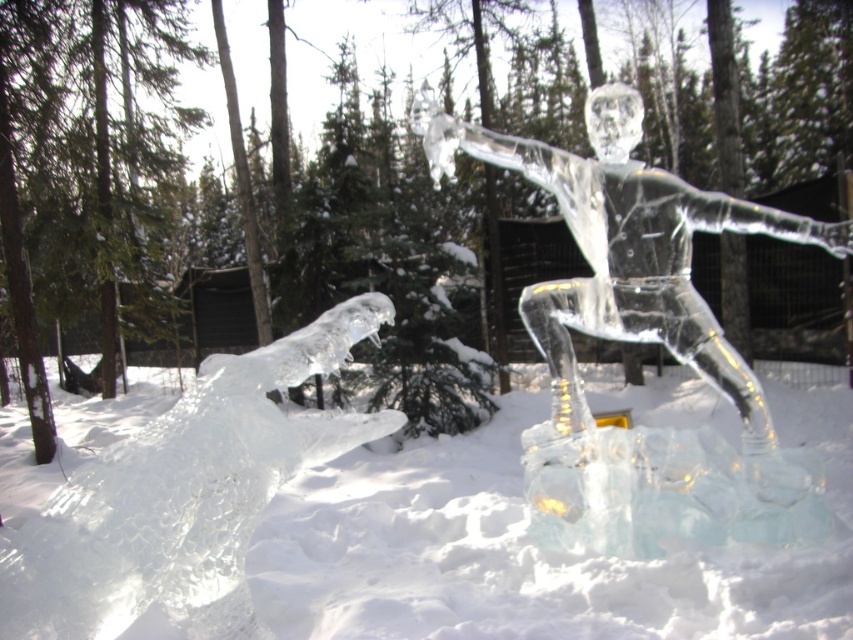
Question: Is transparent ice sculpture at center smaller than clear ice dragon at lower left?

Choices:
 (A) yes
 (B) no

Answer: (B)

Question: Considering the relative positions of transparent ice sculpture at center and clear ice figure at center in the image provided, where is transparent ice sculpture at center located with respect to clear ice figure at center?

Choices:
 (A) below
 (B) above

Answer: (A)

Question: Among these objects, which one is farthest from the camera?

Choices:
 (A) clear ice dragon at lower left
 (B) clear ice figure at center

Answer: (B)

Question: Can you confirm if transparent ice sculpture at center is smaller than clear ice figure at center?

Choices:
 (A) no
 (B) yes

Answer: (A)

Question: Among these objects, which one is farthest from the camera?

Choices:
 (A) transparent ice sculpture at center
 (B) clear ice dragon at lower left

Answer: (A)

Question: Estimate the real-world distances between objects in this image. Which object is closer to the clear ice dragon at lower left?

Choices:
 (A) transparent ice sculpture at center
 (B) clear ice figure at center

Answer: (A)